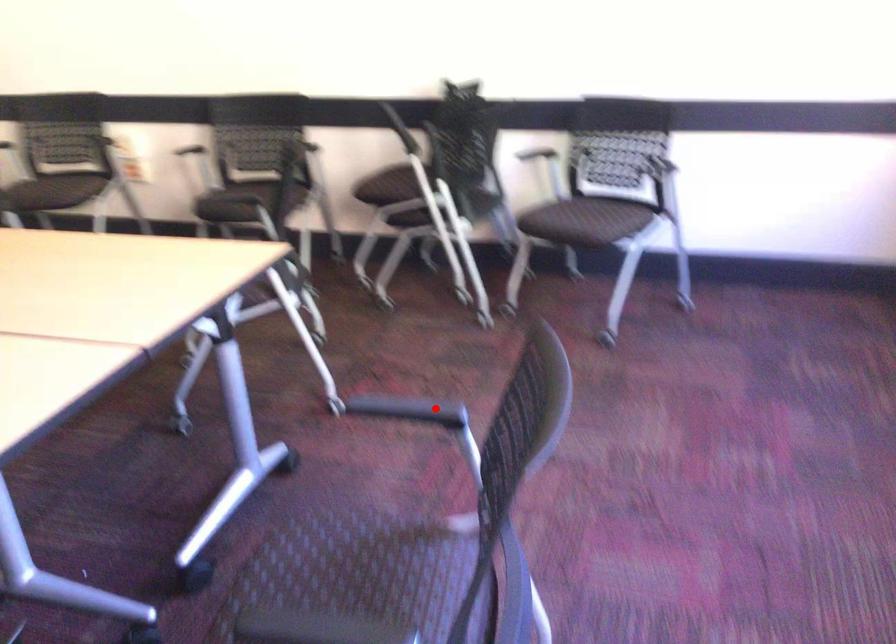
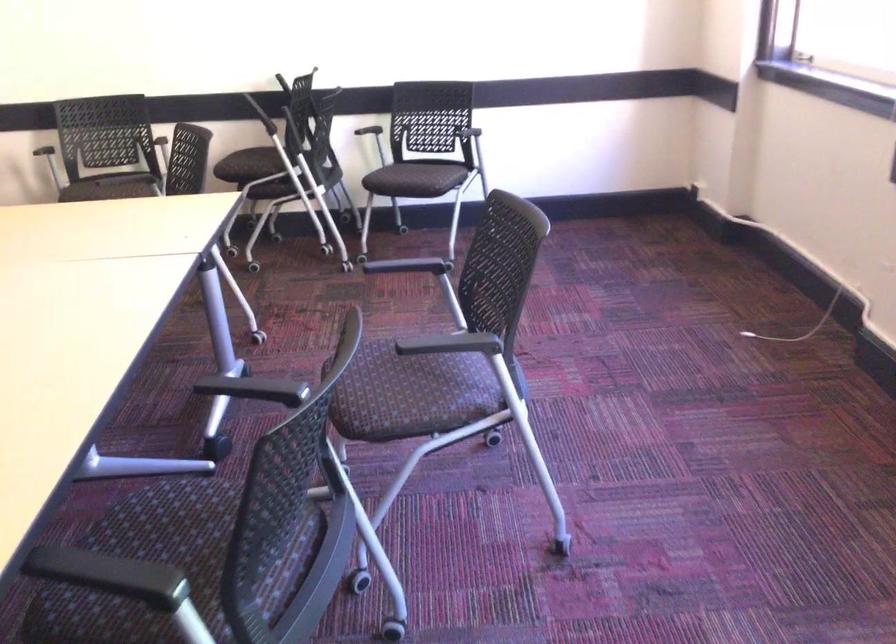
Question: I am providing you with two images of the same scene from different viewpoints. A red point is shown in image1. For the corresponding object point in image2, is it positioned nearer or farther from the camera?

Choices:
 (A) Nearer
 (B) Farther

Answer: (B)